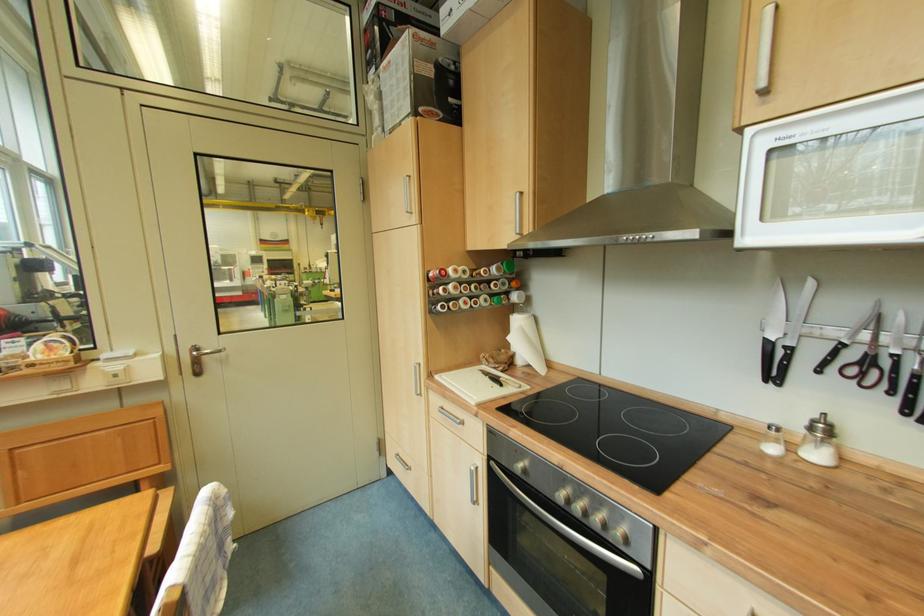
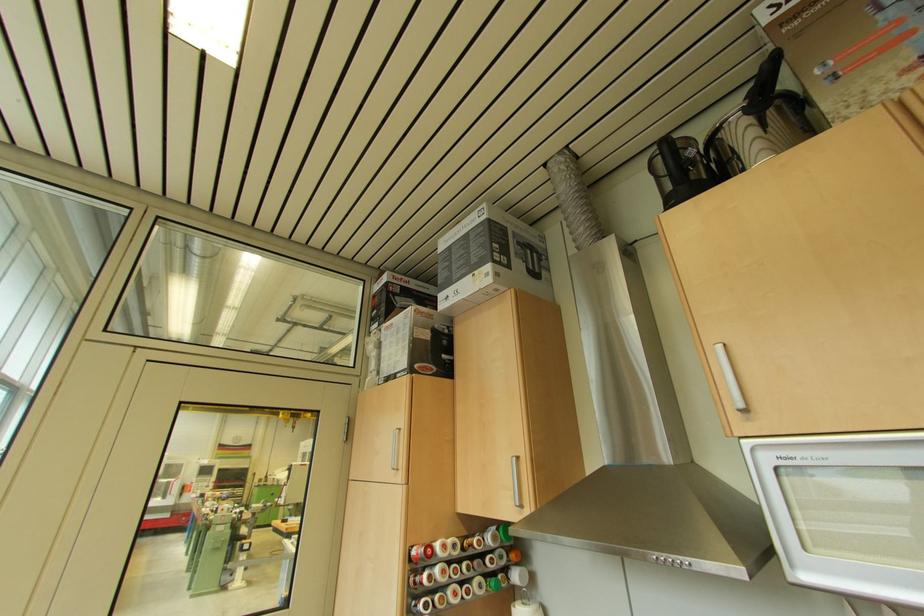
Locate, in the second image, the point that corresponds to (440,116) in the first image.

(434, 371)